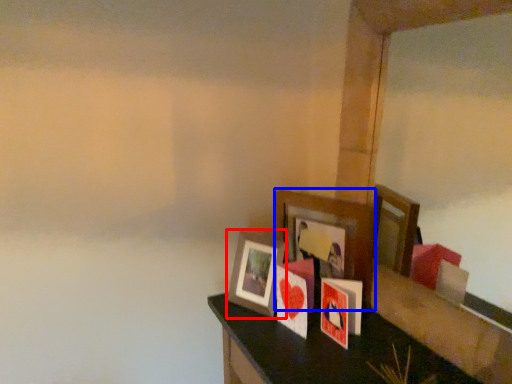
Question: Which object is further to the camera taking this photo, picture frame (highlighted by a red box) or picture frame (highlighted by a blue box)?

Choices:
 (A) picture frame
 (B) picture frame

Answer: (A)